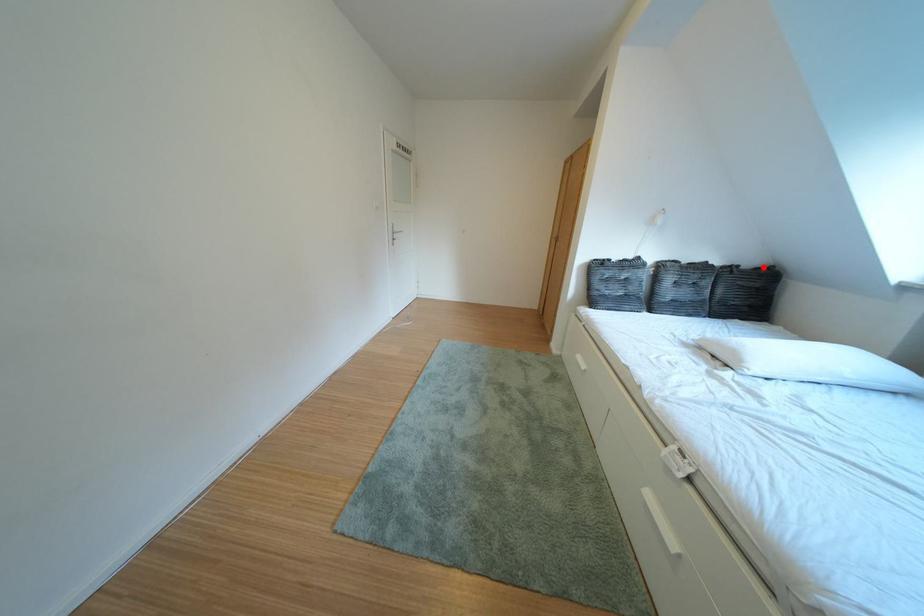
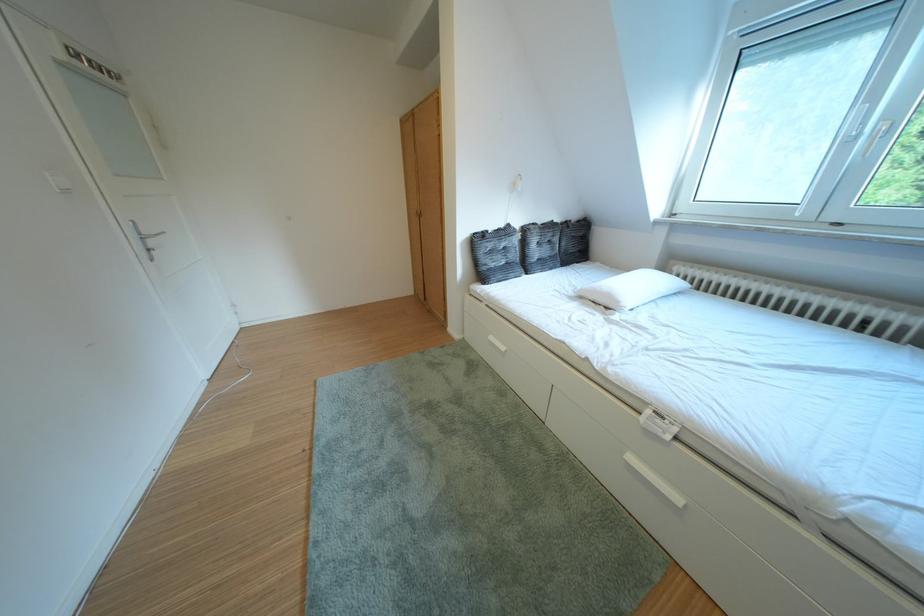
Where in the second image is the point corresponding to the highlighted location from the first image?

(588, 222)